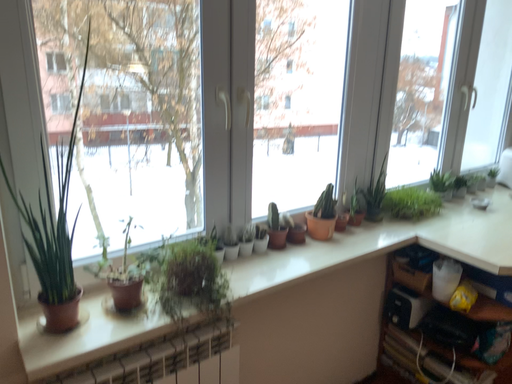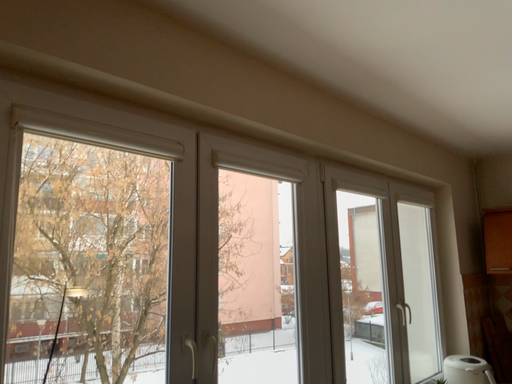
Question: Which way did the camera rotate in the video?

Choices:
 (A) rotated downward
 (B) rotated upward

Answer: (B)